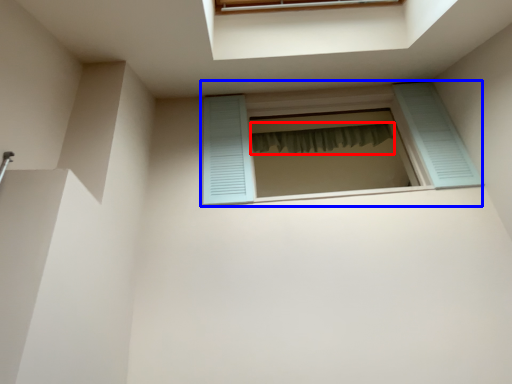
Question: Which of the following is the closest to the observer, shower curtain (highlighted by a red box) or window (highlighted by a blue box)?

Choices:
 (A) shower curtain
 (B) window

Answer: (B)